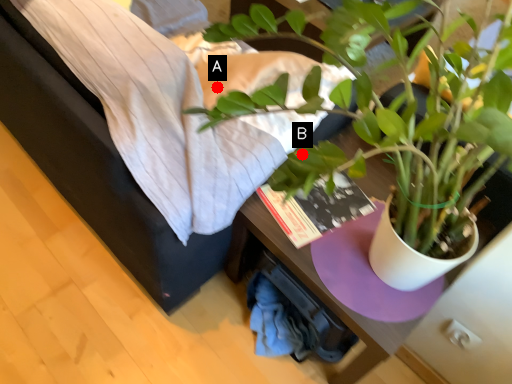
Question: Two points are circled on the image, labeled by A and B beside each circle. Which of the following is the closest to the observer?

Choices:
 (A) A is closer
 (B) B is closer

Answer: (B)